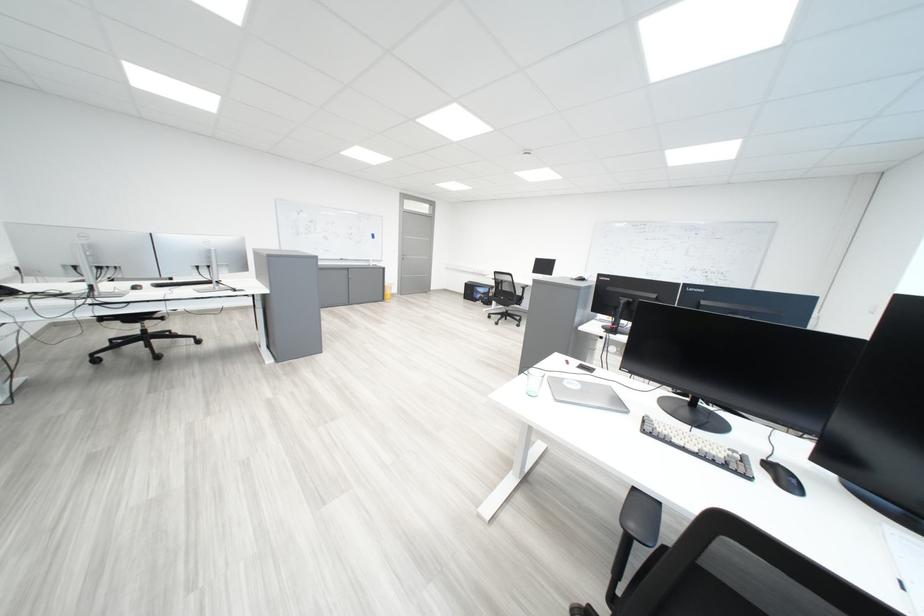
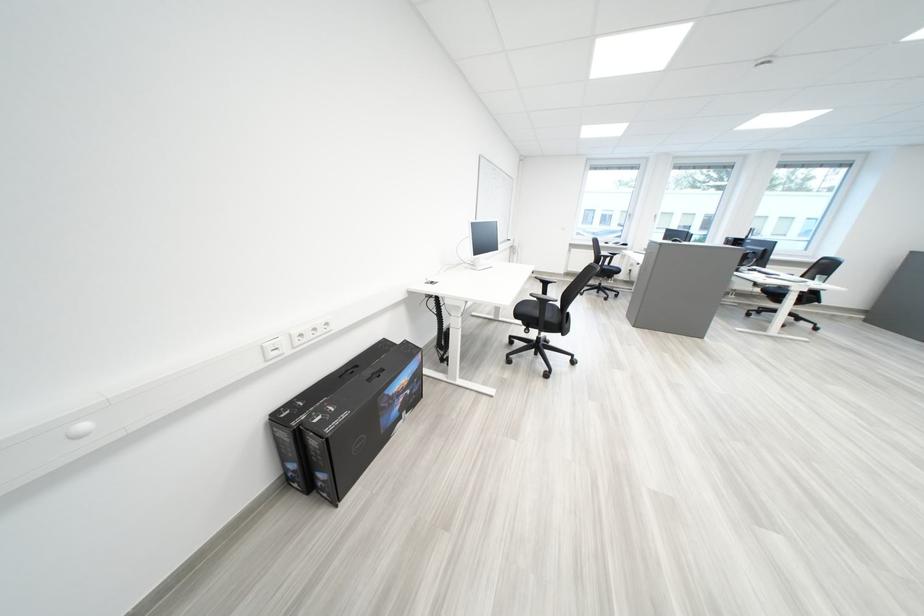
Where in the second image is the point corresponding to [492,294] from the first image?

(411, 395)